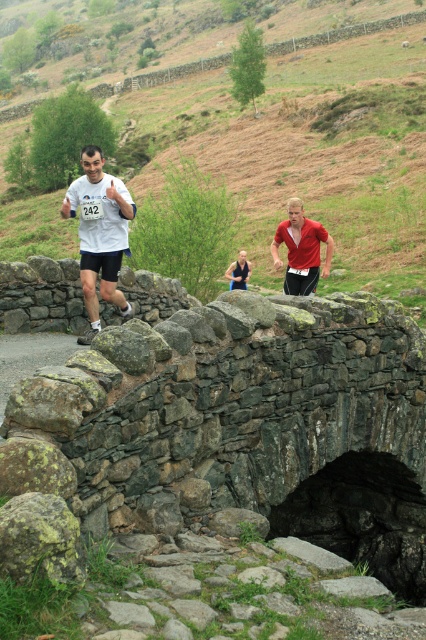
You are a photographer trying to capture the entire scene of the running event. You notice the green grassy hillside at upper center and the red matte shirt at center. Which object should you focus on to ensure both are in frame without cropping?

The green grassy hillside at upper center is bigger than the red matte shirt at center, so focusing on the larger green grassy hillside at upper center will help ensure both objects are included in the frame without cropping.

You are a drone operator trying to capture the best aerial shot of the running event. You need to fly your drone from point A at point (411, 36) to point B at point (106, 198). According to the scene description, which point is closer to the drone when it is at point A?

Point B at point (106, 198) is closer to the drone when it is at point A because the description states that point A is further to the viewer than point B.